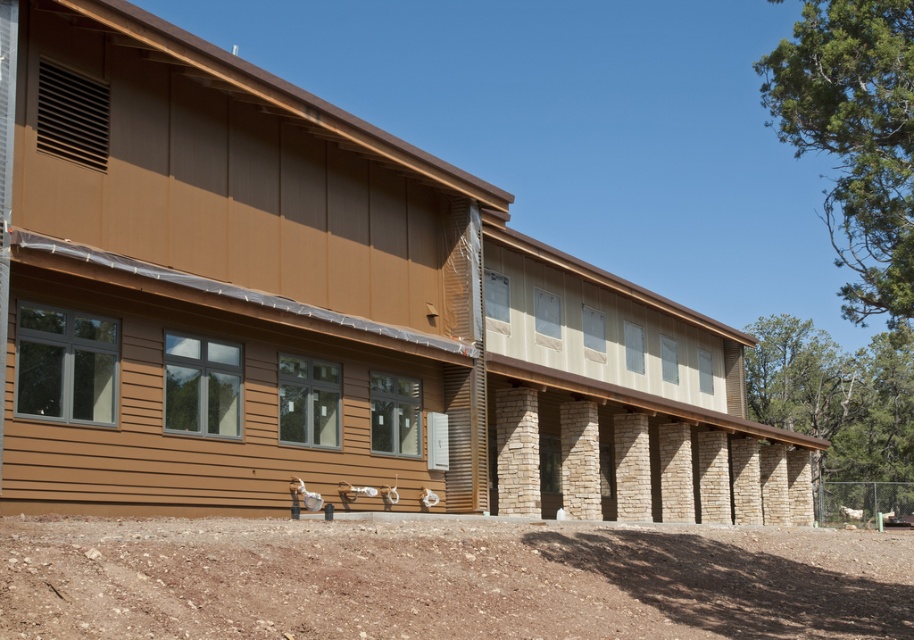
Question: Among these objects, which one is farthest from the camera?

Choices:
 (A) brown wood siding at center
 (B) brown gravel at lower center

Answer: (A)

Question: Is brown wood siding at center thinner than brown gravel at lower center?

Choices:
 (A) yes
 (B) no

Answer: (B)

Question: Does brown wood siding at center come behind brown gravel at lower center?

Choices:
 (A) yes
 (B) no

Answer: (A)

Question: Which of the following is the closest to the observer?

Choices:
 (A) brown wood siding at center
 (B) brown gravel at lower center

Answer: (B)

Question: Among these points, which one is nearest to the camera?

Choices:
 (A) (224, 534)
 (B) (654, 513)

Answer: (A)

Question: Does brown wood siding at center appear under brown gravel at lower center?

Choices:
 (A) yes
 (B) no

Answer: (B)